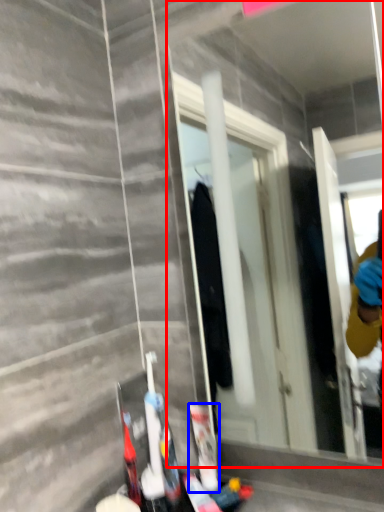
Question: Which object is closer to the camera taking this photo, mirror (highlighted by a red box) or toiletry (highlighted by a blue box)?

Choices:
 (A) mirror
 (B) toiletry

Answer: (A)